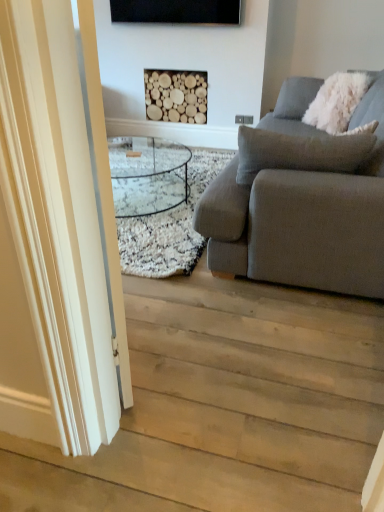
You are a GUI agent. You are given a task and a screenshot of the screen. Output one action in this format:
    pyautogui.click(x=<x>, y=<y>)
    Task: Click on the vacant area to the right of white glossy door at left
    Image resolution: width=384 pixels, height=512 pixels.
    Given the screenshot: What is the action you would take?
    pyautogui.click(x=196, y=344)